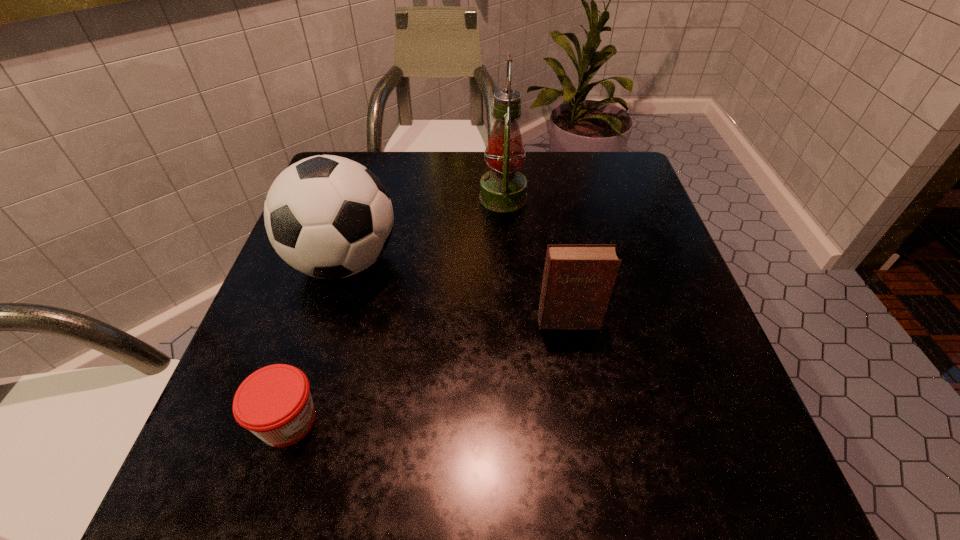
At what (x,y) coordinates should I click in order to perform the action: click on vacant region located 0.100m on the front cover of the diary. Please return your answer as a coordinate pair (x, y). Looking at the image, I should click on (578, 379).

Locate an element on the screen. The height and width of the screenshot is (540, 960). vacant space situated on the label side of the shortest object is located at coordinates (454, 421).

Image resolution: width=960 pixels, height=540 pixels. In order to click on object that is positioned at the far edge in this screenshot , I will do `click(503, 189)`.

In order to click on object that is positioned at the near edge in this screenshot , I will do `click(274, 403)`.

You are a GUI agent. You are given a task and a screenshot of the screen. Output one action in this format:
    pyautogui.click(x=<x>, y=<y>)
    Task: Click on the soccer ball that is at the left edge
    Image resolution: width=960 pixels, height=540 pixels.
    Given the screenshot: What is the action you would take?
    pyautogui.click(x=329, y=217)

Where is `jam at the left edge`? This screenshot has width=960, height=540. jam at the left edge is located at coordinates pos(274,403).

Identify the location of object that is at the near left corner. This screenshot has height=540, width=960. (274, 403).

Identify the location of blank space at the far edge of the desktop. The image size is (960, 540). (545, 190).

Image resolution: width=960 pixels, height=540 pixels. In order to click on free space at the near edge in this screenshot , I will do `click(335, 457)`.

At what (x,y) coordinates should I click in order to perform the action: click on vacant region at the left edge of the desktop. Please return your answer as a coordinate pair (x, y). This screenshot has width=960, height=540. Looking at the image, I should click on [326, 353].